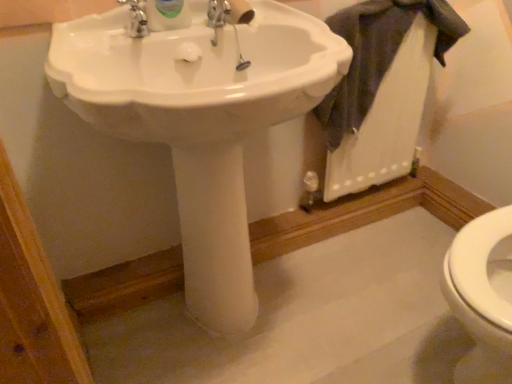
Find the location of `vacant space underneath white glossy sink at center (from a real-world perspective)`. vacant space underneath white glossy sink at center (from a real-world perspective) is located at coordinates (227, 331).